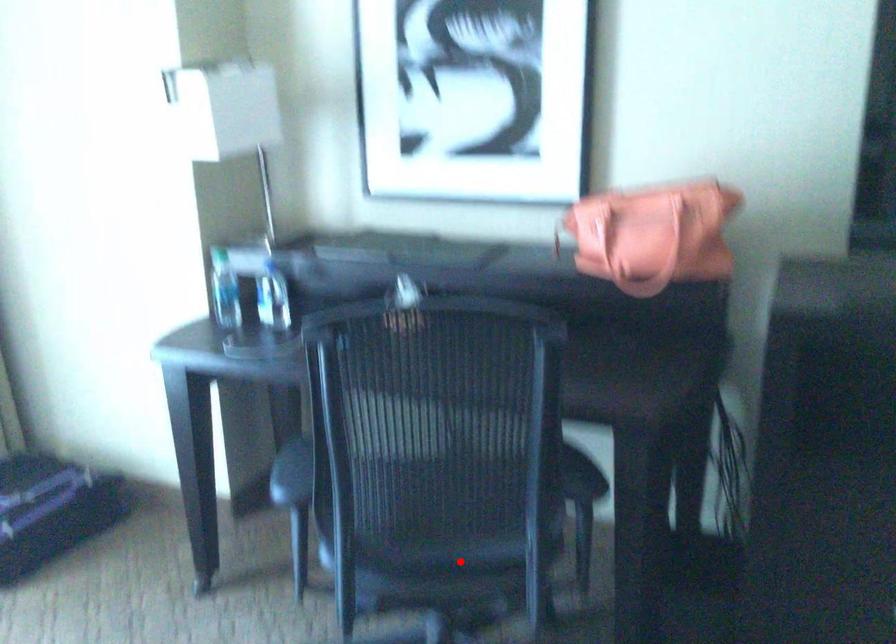
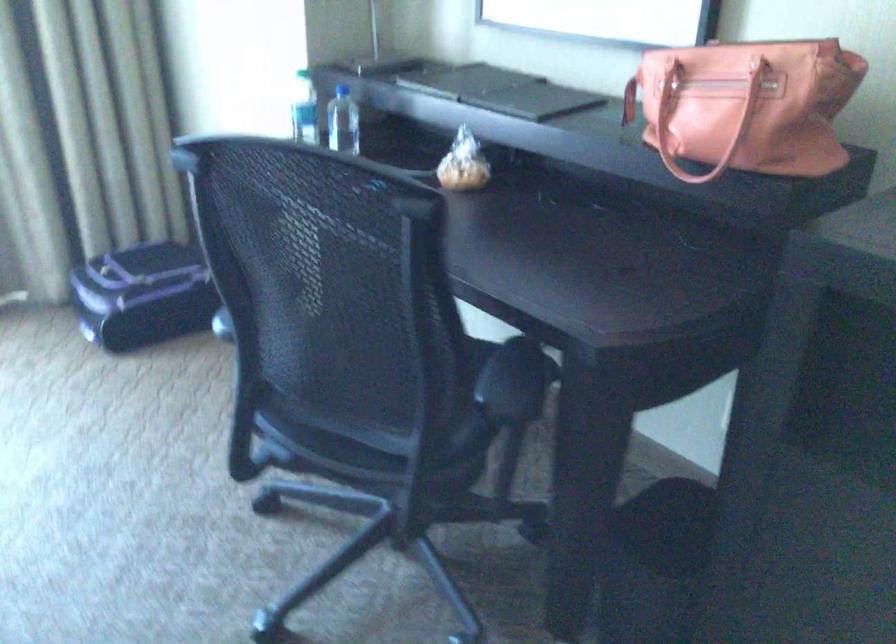
Question: I am providing you with two images of the same scene from different viewpoints. Image1 has a red point marked. In image2, the corresponding 3D location appears at what relative position? Reply with the corresponding letter.

Choices:
 (A) Closer
 (B) Farther

Answer: (A)